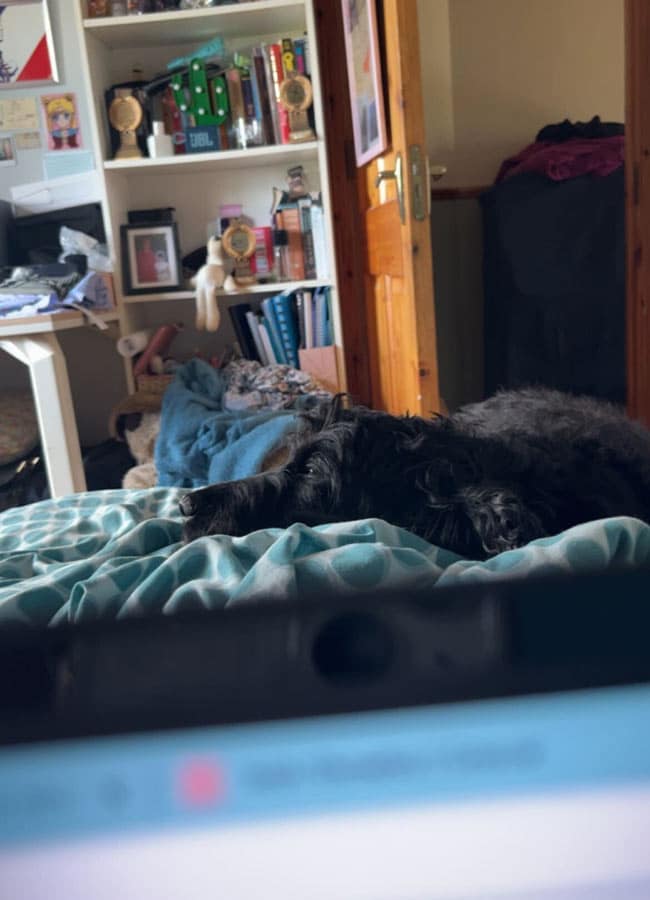
Where is `white color in framed picture`? Image resolution: width=650 pixels, height=900 pixels. white color in framed picture is located at coordinates (20, 36).